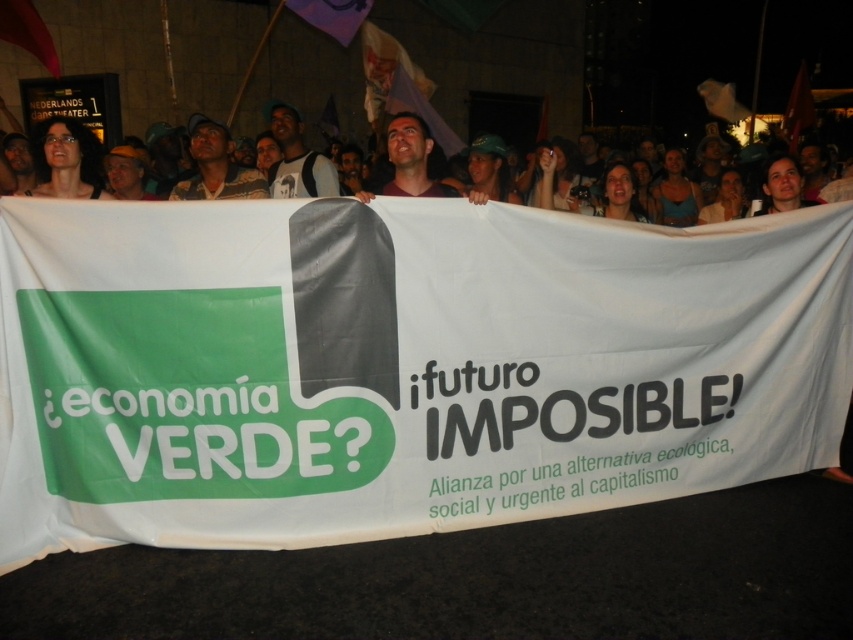
You are a photographer trying to capture the protest banner clearly. You notice a matte black backpack at upper center and a matte brown shirt at center in your frame. Which object is closer to the camera, based on their sizes?

The matte black backpack at upper center has a greater height compared to the matte brown shirt at center, so it is closer to the camera since larger size in the frame indicates proximity.